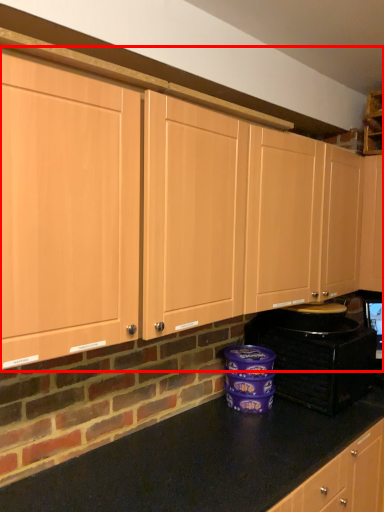
Question: Observing the image, what is the correct spatial positioning of cabinetry (annotated by the red box) in reference to home appliance?

Choices:
 (A) right
 (B) left

Answer: (B)